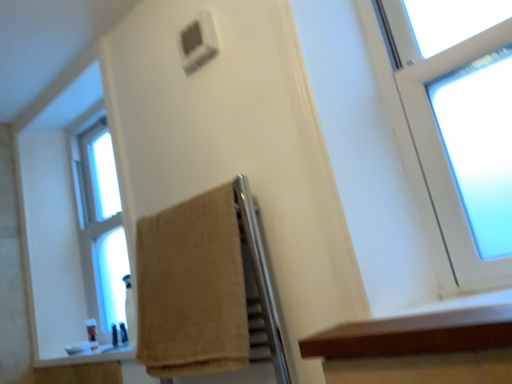
Question: Is clear glass window at left far from translucent plastic soap at lower left?

Choices:
 (A) no
 (B) yes

Answer: (A)

Question: Is clear glass window at left smaller than translucent plastic soap at lower left?

Choices:
 (A) yes
 (B) no

Answer: (B)

Question: Can you confirm if clear glass window at left is thinner than translucent plastic soap at lower left?

Choices:
 (A) yes
 (B) no

Answer: (B)

Question: From the image's perspective, is clear glass window at left located above translucent plastic soap at lower left?

Choices:
 (A) yes
 (B) no

Answer: (A)

Question: Could you tell me if clear glass window at left is turned towards translucent plastic soap at lower left?

Choices:
 (A) no
 (B) yes

Answer: (B)

Question: Does point (410, 344) appear closer or farther from the camera than point (94, 324)?

Choices:
 (A) closer
 (B) farther

Answer: (A)

Question: From the image's perspective, is brown wood ledge at lower right positioned above or below translucent plastic soap at lower left?

Choices:
 (A) below
 (B) above

Answer: (B)

Question: Considering the positions of brown wood ledge at lower right and translucent plastic soap at lower left in the image, is brown wood ledge at lower right bigger or smaller than translucent plastic soap at lower left?

Choices:
 (A) small
 (B) big

Answer: (B)

Question: In terms of height, does brown wood ledge at lower right look taller or shorter compared to translucent plastic soap at lower left?

Choices:
 (A) short
 (B) tall

Answer: (A)

Question: From a real-world perspective, is brown wood ledge at lower right positioned above or below clear glass window at left?

Choices:
 (A) below
 (B) above

Answer: (A)

Question: Visually, is brown wood ledge at lower right positioned to the left or to the right of clear glass window at left?

Choices:
 (A) left
 (B) right

Answer: (B)

Question: Is brown wood ledge at lower right wider or thinner than clear glass window at left?

Choices:
 (A) thin
 (B) wide

Answer: (B)

Question: Is brown wood ledge at lower right in front of or behind clear glass window at left in the image?

Choices:
 (A) behind
 (B) front

Answer: (B)

Question: Is clear glass window at left to the left or to the right of brown wood ledge at lower right in the image?

Choices:
 (A) left
 (B) right

Answer: (A)

Question: From the image's perspective, is clear glass window at left above or below brown wood ledge at lower right?

Choices:
 (A) below
 (B) above

Answer: (B)